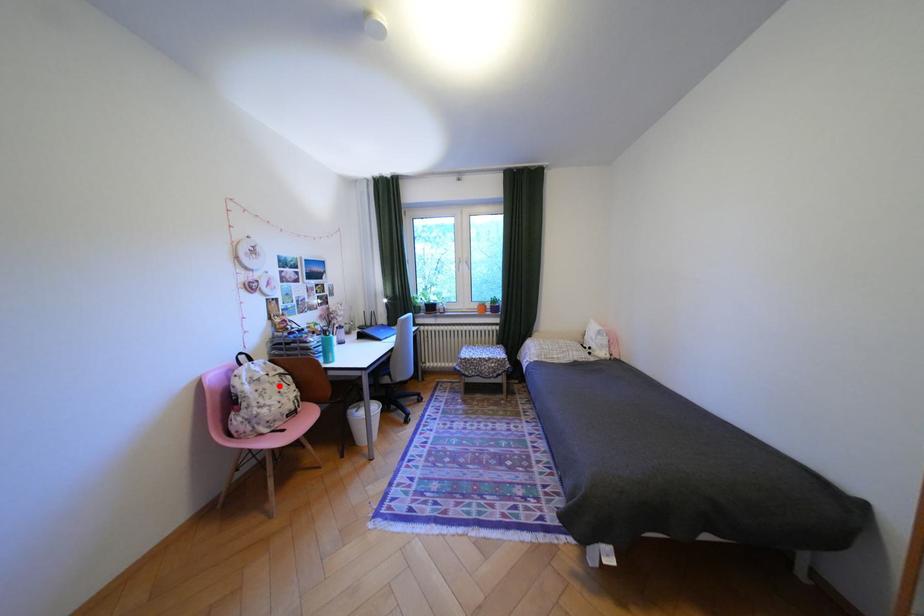
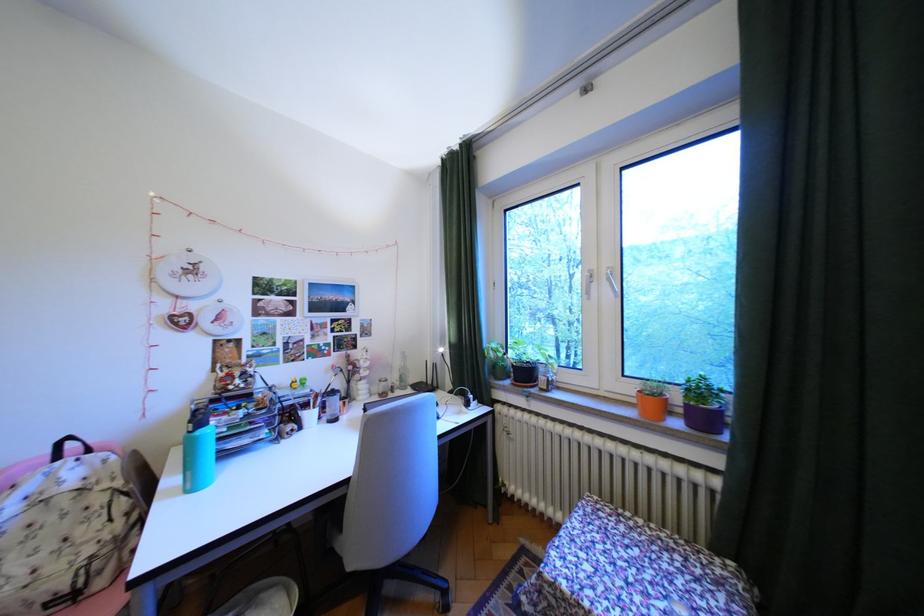
Question: I am providing you with two images of the same scene from different viewpoints. Image1 has a red point marked. In image2, the corresponding 3D location appears at what relative position? Reply with the corresponding letter.

Choices:
 (A) Closer
 (B) Farther

Answer: (A)